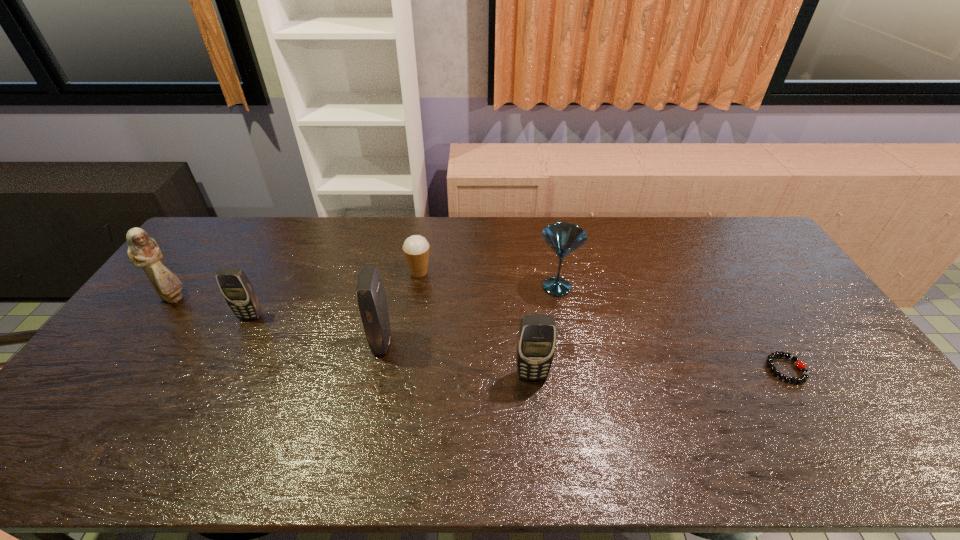
Find the location of a particular element. The height and width of the screenshot is (540, 960). vacant space that satisfies the following two spatial constraints: 1. on the front face of the third object from left to right; 2. on the right side of the rightmost object is located at coordinates (377, 369).

Where is `free space that satisfies the following two spatial constraints: 1. on the front face of the third object from left to right; 2. on the back side of the bracelet`? This screenshot has height=540, width=960. free space that satisfies the following two spatial constraints: 1. on the front face of the third object from left to right; 2. on the back side of the bracelet is located at coordinates (377, 369).

You are a GUI agent. You are given a task and a screenshot of the screen. Output one action in this format:
    pyautogui.click(x=<x>, y=<y>)
    Task: Click on the free space that satisfies the following two spatial constraints: 1. on the front-facing side of the bracelet; 2. on the right side of the leftmost object
    The width and height of the screenshot is (960, 540).
    Given the screenshot: What is the action you would take?
    pyautogui.click(x=122, y=369)

The image size is (960, 540). I want to click on free location that satisfies the following two spatial constraints: 1. on the front face of the second cellular telephone from right to left; 2. on the back side of the shortest object, so click(x=377, y=369).